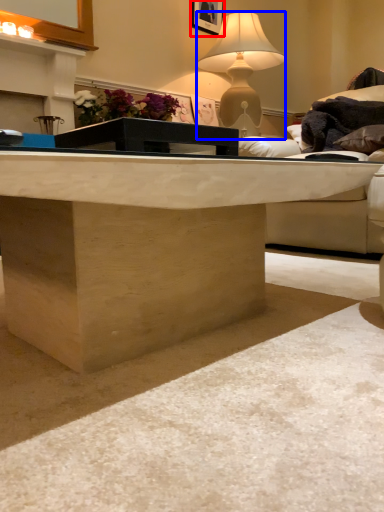
Question: Which object is closer to the camera taking this photo, picture frame (highlighted by a red box) or lamp (highlighted by a blue box)?

Choices:
 (A) picture frame
 (B) lamp

Answer: (B)